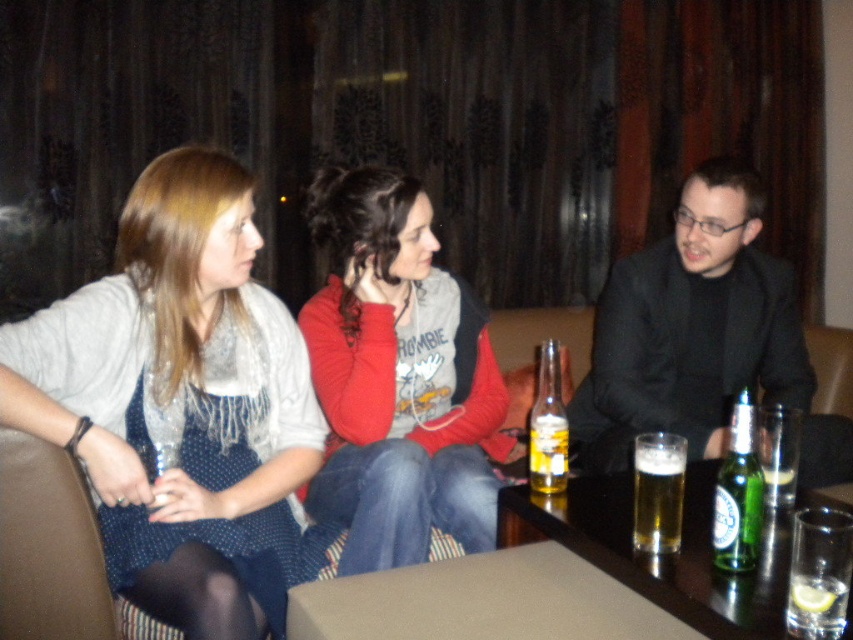
Which of these two, matte gray sweater at center or green glass bottle at lower right, stands shorter?

green glass bottle at lower right

Can you confirm if matte gray sweater at center is positioned above green glass bottle at lower right?

Yes.

I want to click on matte gray sweater at center, so click(183, 404).

This screenshot has height=640, width=853. I want to click on matte gray sweater at center, so click(183, 404).

Can you confirm if black matte jacket at center is positioned to the left of translucent glass bottle at center?

No, black matte jacket at center is not to the left of translucent glass bottle at center.

Is black matte jacket at center taller than translucent glass bottle at center?

Yes, black matte jacket at center is taller than translucent glass bottle at center.

Which is in front, point (601, 340) or point (556, 458)?

Point (556, 458) is more forward.

Locate an element on the screen. Image resolution: width=853 pixels, height=640 pixels. black matte jacket at center is located at coordinates (691, 328).

Between matte gray sweater at center and red hoodie at center, which one has more height?

With more height is matte gray sweater at center.

Is point (331, 540) positioned in front of point (339, 225)?

Yes, point (331, 540) is in front of point (339, 225).

Where is `matte gray sweater at center`? Image resolution: width=853 pixels, height=640 pixels. matte gray sweater at center is located at coordinates (183, 404).